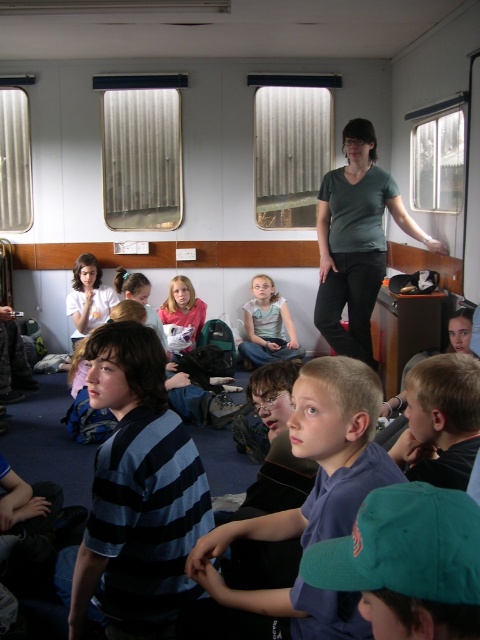
You are a teacher standing at the front of the train carriage. You notice two children wearing a blue striped shirt at center and a matte pink shirt at center. If you want to move between them to check their work, how much space do you need to ensure you can comfortably pass through?

The blue striped shirt at center and matte pink shirt at center are 12.09 feet apart from each other. To comfortably pass between them, you would need at least 3 feet of space, so the existing distance is sufficient.

You are a photographer standing at the front of the train carriage. You want to take a photo that includes both the blue striped shirt at center and the blonde hair at center. What is the minimum distance you need to move backward to ensure both subjects are fully in frame?

The blue striped shirt at center and blonde hair at center are 42.08 centimeters apart from each other. To ensure both are fully in frame, you need to move backward until the camera can capture a field of view that accommodates at least 42.08 centimeters between them. The exact distance depends on your camera lens, but the minimum distance would be when the lens can just cover this separation at its widest angle.

You are a photographer trying to capture a group shot of the children in the train carriage. You want to ensure that both the blue striped shirt at center and the matte pink shirt at center are fully visible in the photo. Based on their positions, which child should you position closer to the edge of the frame to avoid overlapping?

The blue striped shirt at center might be wider than matte pink shirt at center, so positioning the child in the blue striped shirt at center closer to the edge of the frame would help avoid overlapping with the narrower matte pink shirt at center.